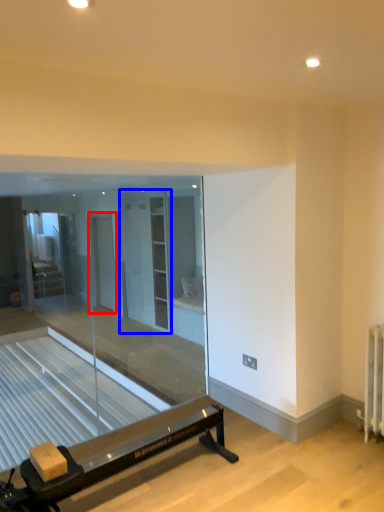
Question: Which object appears farthest to the camera in this image, screen door (highlighted by a red box) or screen door (highlighted by a blue box)?

Choices:
 (A) screen door
 (B) screen door

Answer: (A)